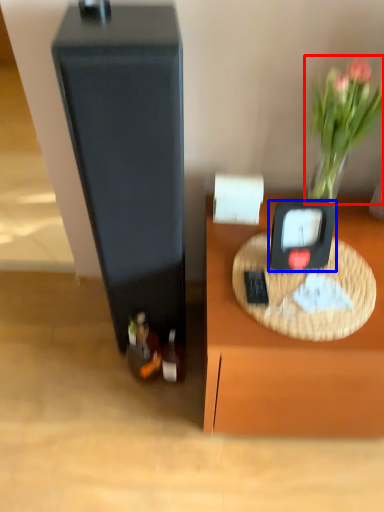
Question: Which point is closer to the camera, plant (highlighted by a red box) or weight scale (highlighted by a blue box)?

Choices:
 (A) plant
 (B) weight scale

Answer: (A)